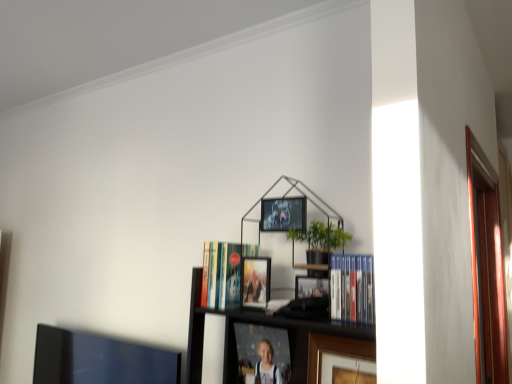
Question: Is the position of blue hardcover books at center-right, positioned as the second book in back-to-front order, less distant than that of hardcover book at center, arranged as the first book when viewed from the back?

Choices:
 (A) no
 (B) yes

Answer: (B)

Question: Does blue hardcover books at center-right, positioned as the second book in back-to-front order, have a lesser width compared to hardcover book at center, the 1th book viewed from the left?

Choices:
 (A) yes
 (B) no

Answer: (A)

Question: From the image's perspective, would you say blue hardcover books at center-right, marked as the first book in a front-to-back arrangement, is shown under hardcover book at center, which is the 2th book in right-to-left order?

Choices:
 (A) yes
 (B) no

Answer: (B)

Question: Considering the relative sizes of blue hardcover books at center-right, the first book from the right, and hardcover book at center, which is the 2th book in right-to-left order, in the image provided, is blue hardcover books at center-right, the first book from the right, shorter than hardcover book at center, which is the 2th book in right-to-left order,?

Choices:
 (A) no
 (B) yes

Answer: (B)

Question: Is hardcover book at center, positioned as the second book in front-to-back order, located within blue hardcover books at center-right, which is the 2th book from left to right?

Choices:
 (A) no
 (B) yes

Answer: (A)

Question: Is metallic silver picture frame at upper center, which is the fourth picture frame from bottom to top, spatially inside hardcover book at center, arranged as the first book when viewed from the back, or outside of it?

Choices:
 (A) inside
 (B) outside

Answer: (B)

Question: From a real-world perspective, relative to hardcover book at center, arranged as the first book when viewed from the back, is metallic silver picture frame at upper center, which is the fourth picture frame from bottom to top, vertically above or below?

Choices:
 (A) above
 (B) below

Answer: (A)

Question: Considering the positions of metallic silver picture frame at upper center, marked as the first picture frame in a top-to-bottom arrangement, and hardcover book at center, which is the 2th book in right-to-left order, in the image, is metallic silver picture frame at upper center, marked as the first picture frame in a top-to-bottom arrangement, taller or shorter than hardcover book at center, which is the 2th book in right-to-left order,?

Choices:
 (A) short
 (B) tall

Answer: (A)

Question: Considering the positions of point (305, 221) and point (231, 297), is point (305, 221) closer or farther from the camera than point (231, 297)?

Choices:
 (A) closer
 (B) farther

Answer: (A)

Question: Visually, is hardcover book at center, positioned as the second book in front-to-back order, positioned to the left or to the right of metallic silver picture frame at upper center, which is the fourth picture frame from bottom to top?

Choices:
 (A) right
 (B) left

Answer: (B)

Question: In terms of width, does hardcover book at center, arranged as the first book when viewed from the back, look wider or thinner when compared to metallic silver picture frame at upper center, marked as the first picture frame in a top-to-bottom arrangement?

Choices:
 (A) thin
 (B) wide

Answer: (B)

Question: From a real-world perspective, is hardcover book at center, which is the 2th book in right-to-left order, physically located above or below metallic silver picture frame at upper center, marked as the first picture frame in a top-to-bottom arrangement?

Choices:
 (A) below
 (B) above

Answer: (A)

Question: Is hardcover book at center, which is the 2th book in right-to-left order, in front of or behind metallic silver picture frame at upper center, which is the fourth picture frame from bottom to top, in the image?

Choices:
 (A) behind
 (B) front

Answer: (A)

Question: From a real-world perspective, is gold-framed photo at center, which appears as the third picture frame when viewed from the top, above or below metallic silver picture frame at upper center, which is the fourth picture frame from bottom to top?

Choices:
 (A) below
 (B) above

Answer: (A)

Question: In the image, is gold-framed photo at center, which appears as the third picture frame when viewed from the top, on the left side or the right side of metallic silver picture frame at upper center, marked as the first picture frame in a top-to-bottom arrangement?

Choices:
 (A) right
 (B) left

Answer: (A)